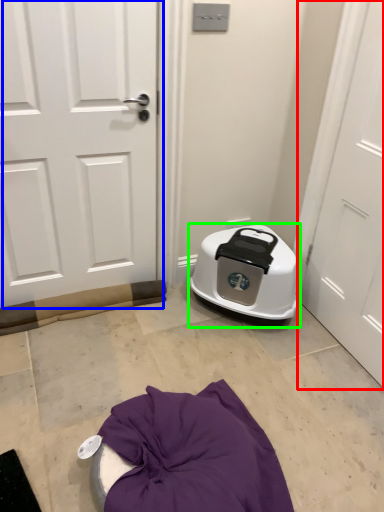
Question: Estimate the real-world distances between objects in this image. Which object is farther from door (highlighted by a red box), door (highlighted by a blue box) or appliance (highlighted by a green box)?

Choices:
 (A) door
 (B) appliance

Answer: (A)